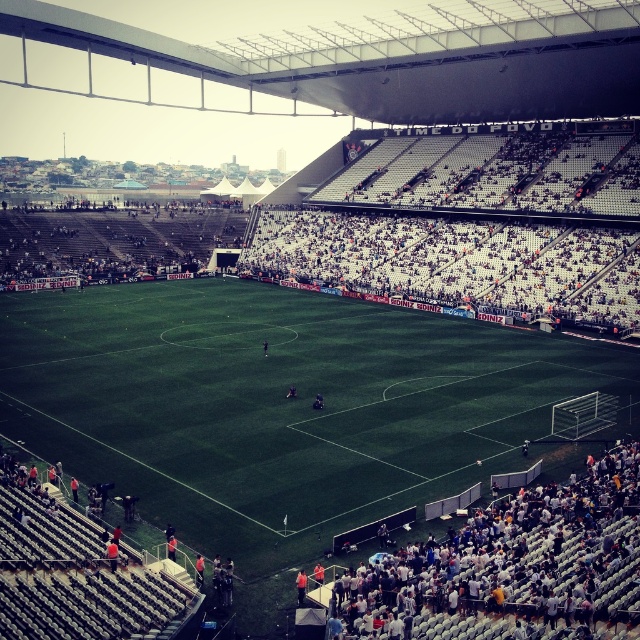
Question: Is green grass football field at center to the right of white fabric crowd at lower right from the viewer's perspective?

Choices:
 (A) no
 (B) yes

Answer: (A)

Question: Can you confirm if green grass football field at center is smaller than white fabric crowd at lower right?

Choices:
 (A) no
 (B) yes

Answer: (A)

Question: Which object appears farthest from the camera in this image?

Choices:
 (A) white fabric crowd at lower right
 (B) green grass football field at center

Answer: (B)

Question: Observing the image, what is the correct spatial positioning of green grass football field at center in reference to white fabric crowd at lower right?

Choices:
 (A) left
 (B) right

Answer: (A)

Question: Which of the following is the farthest from the observer?

Choices:
 (A) green grass football field at center
 (B) white fabric crowd at lower right

Answer: (A)